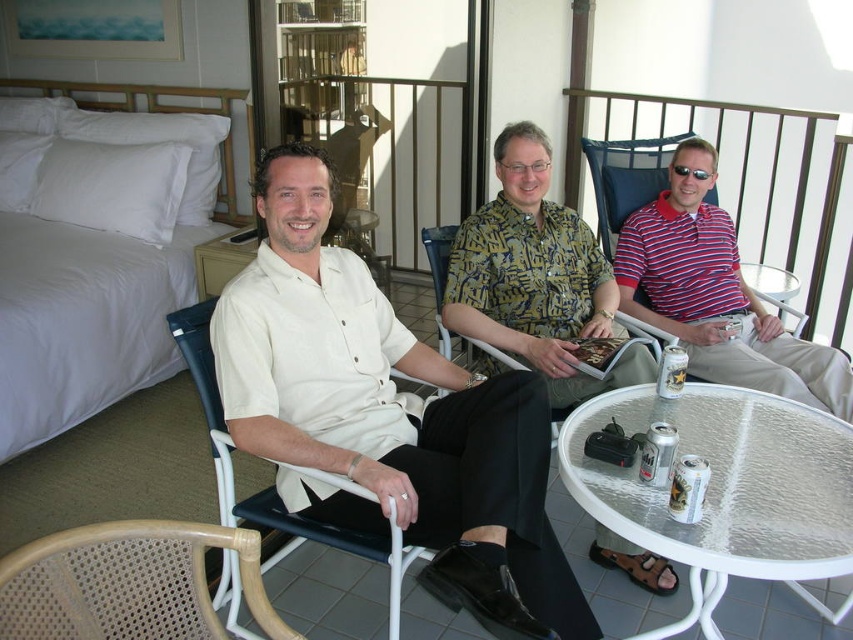
Is printed fabric shirt at center wider than patterned fabric chair at center?

Correct, the width of printed fabric shirt at center exceeds that of patterned fabric chair at center.

This screenshot has height=640, width=853. In order to click on printed fabric shirt at center in this screenshot , I will do `click(535, 276)`.

Locate an element on the screen. printed fabric shirt at center is located at coordinates (535, 276).

The image size is (853, 640). What do you see at coordinates (271, 484) in the screenshot? I see `white plastic chair at center` at bounding box center [271, 484].

You are a GUI agent. You are given a task and a screenshot of the screen. Output one action in this format:
    pyautogui.click(x=<x>, y=<y>)
    Task: Click on the white plastic chair at center
    This screenshot has width=853, height=640.
    Given the screenshot: What is the action you would take?
    pyautogui.click(x=271, y=484)

Is printed fabric shirt at center to the left of woven wood chair at lower left from the viewer's perspective?

In fact, printed fabric shirt at center is to the right of woven wood chair at lower left.

Does printed fabric shirt at center have a greater width compared to woven wood chair at lower left?

Yes.

You are a GUI agent. You are given a task and a screenshot of the screen. Output one action in this format:
    pyautogui.click(x=<x>, y=<y>)
    Task: Click on the printed fabric shirt at center
    
    Given the screenshot: What is the action you would take?
    pyautogui.click(x=535, y=276)

Locate an element on the screen. The image size is (853, 640). printed fabric shirt at center is located at coordinates (535, 276).